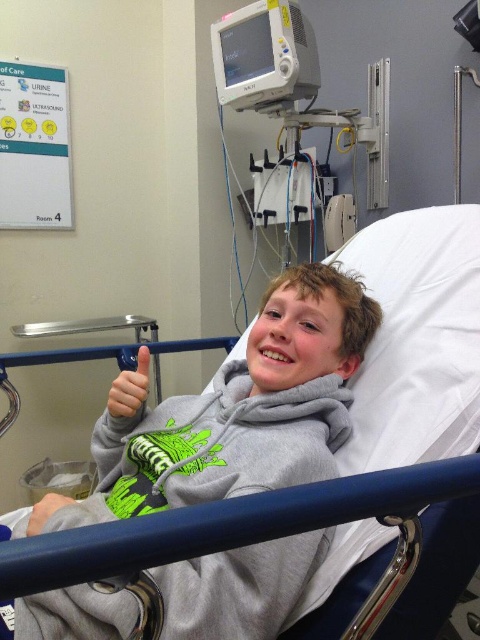
The scene shows a cheerful boy in a hospital bed. You are a nurse checking his vital signs. You need to place a blood pressure cuff on his arm. The gray matte hoodie at center and the gray fabric hand at lower left are both visible. Which object is closer to the left side of the image?

The gray fabric hand at lower left is closer to the left side of the image because the gray matte hoodie at center is positioned to its right.

You are a nurse checking on the patient in Room 4. You need to hand the boy a small toy to cheer him up. The toy is 10 inches in length. Can you place it on the gray matte hoodie at center without it falling off?

The gray matte hoodie at center is 27.09 inches away from the viewer. Since the toy is only 10 inches long, placing it on the hoodie would require the toy to be within reach. However, the distance between the nurse and the hoodie is 27.09 inches, so the nurse can safely place the toy on the hoodie as the distance is manageable and the toy won